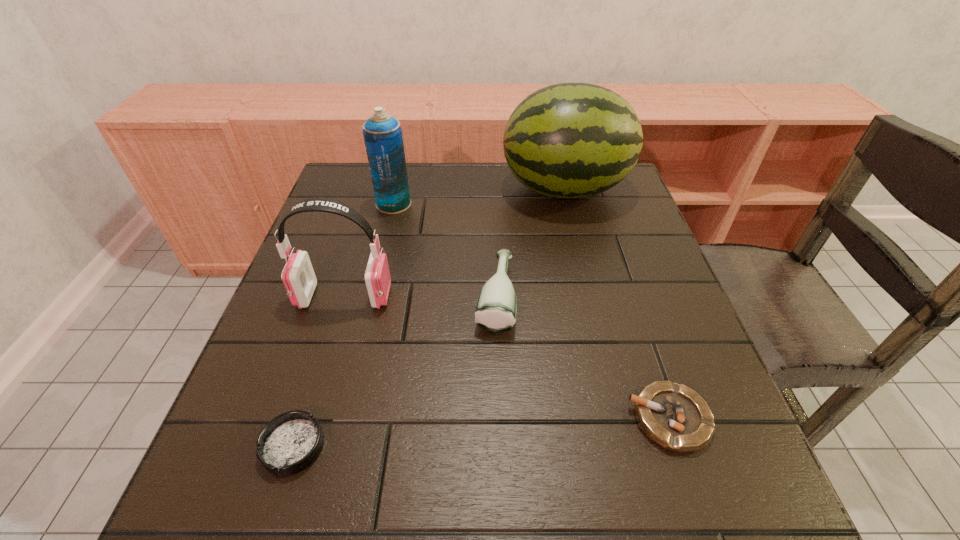
Locate an element on the screen. The image size is (960, 540). free space between the third shortest object and the watermelon is located at coordinates (530, 244).

Point out which object is positioned as the third nearest to the bottle. Please provide its 2D coordinates. Your answer should be formatted as a tuple, i.e. [(x, y)], where the tuple contains the x and y coordinates of a point satisfying the conditions above.

[(675, 417)]

The height and width of the screenshot is (540, 960). Find the location of `the third closest object to the shortest object`. the third closest object to the shortest object is located at coordinates (675, 417).

You are a GUI agent. You are given a task and a screenshot of the screen. Output one action in this format:
    pyautogui.click(x=<x>, y=<y>)
    Task: Click on the vacant space that satisfies the following two spatial constraints: 1. on the front side of the bottle; 2. on the right side of the right ashtray
    
    Given the screenshot: What is the action you would take?
    pyautogui.click(x=499, y=418)

Locate an element on the screen. free region that satisfies the following two spatial constraints: 1. at the stem end of the right ashtray; 2. on the right side of the watermelon is located at coordinates (621, 418).

At what (x,y) coordinates should I click in order to perform the action: click on free point that satisfies the following two spatial constraints: 1. on the front side of the bottle; 2. on the left side of the aerosol can. Please return your answer as a coordinate pair (x, y). Looking at the image, I should click on (372, 297).

This screenshot has width=960, height=540. Identify the location of free space that satisfies the following two spatial constraints: 1. at the stem end of the watermelon; 2. on the left side of the right ashtray. (621, 418).